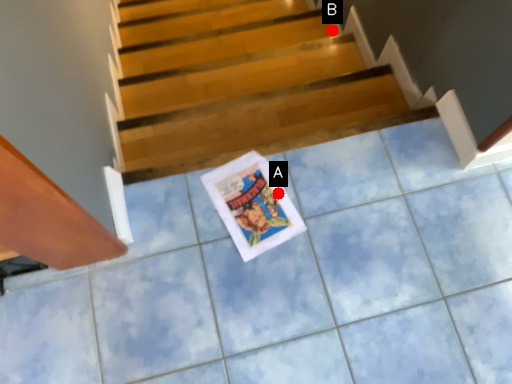
Question: Two points are circled on the image, labeled by A and B beside each circle. Which point is closer to the camera taking this photo?

Choices:
 (A) A is closer
 (B) B is closer

Answer: (A)